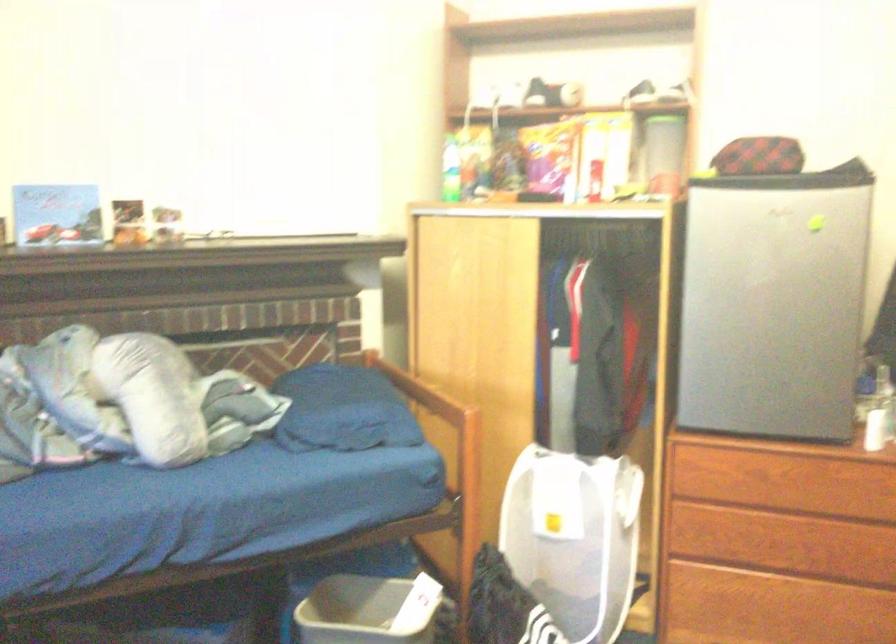
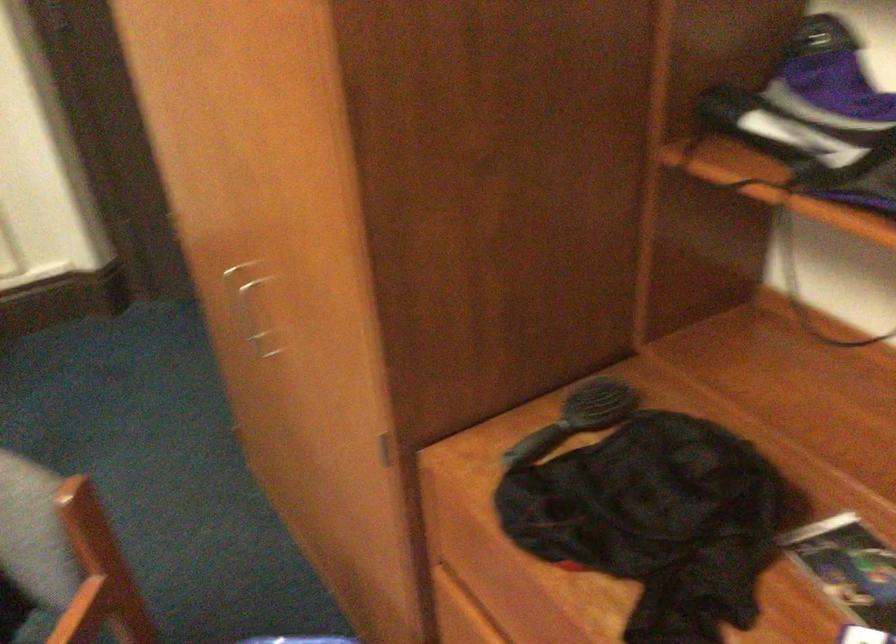
The first image is from the beginning of the video and the second image is from the end. How did the camera likely rotate when shooting the video?

The rotation direction of the camera is right-down.